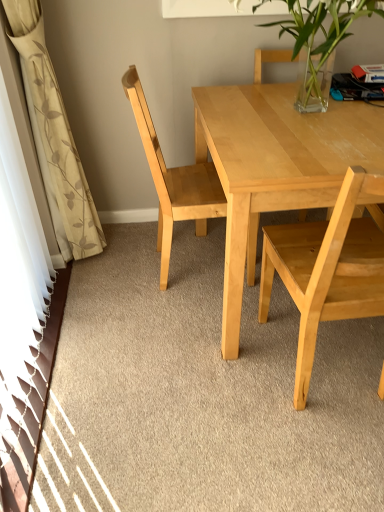
Question: Can we say clear glass vase at upper center lies outside light wood table at center?

Choices:
 (A) no
 (B) yes

Answer: (B)

Question: Is clear glass vase at upper center surrounding light wood table at center?

Choices:
 (A) no
 (B) yes

Answer: (A)

Question: Are clear glass vase at upper center and light wood table at center beside each other?

Choices:
 (A) yes
 (B) no

Answer: (B)

Question: From the image's perspective, is clear glass vase at upper center below light wood table at center?

Choices:
 (A) yes
 (B) no

Answer: (B)

Question: From a real-world perspective, is clear glass vase at upper center over light wood table at center?

Choices:
 (A) yes
 (B) no

Answer: (A)

Question: Does clear glass vase at upper center turn towards light wood table at center?

Choices:
 (A) yes
 (B) no

Answer: (B)

Question: Is white floral fabric curtain at left facing towards light wood chair at center, the first chair from the left?

Choices:
 (A) no
 (B) yes

Answer: (B)

Question: Does white floral fabric curtain at left come in front of light wood chair at center, placed as the 2th chair when sorted from right to left?

Choices:
 (A) yes
 (B) no

Answer: (A)

Question: Is white floral fabric curtain at left next to light wood chair at center, the first chair from the left?

Choices:
 (A) no
 (B) yes

Answer: (A)

Question: From a real-world perspective, is white floral fabric curtain at left located higher than light wood chair at center, the first chair from the left?

Choices:
 (A) no
 (B) yes

Answer: (B)

Question: From a real-world perspective, is white floral fabric curtain at left under light wood chair at center, placed as the 2th chair when sorted from right to left?

Choices:
 (A) no
 (B) yes

Answer: (A)

Question: Can you confirm if white floral fabric curtain at left is taller than light wood chair at center, the first chair from the left?

Choices:
 (A) no
 (B) yes

Answer: (B)

Question: Does white floral fabric curtain at left lie in front of clear glass vase at upper center?

Choices:
 (A) yes
 (B) no

Answer: (B)